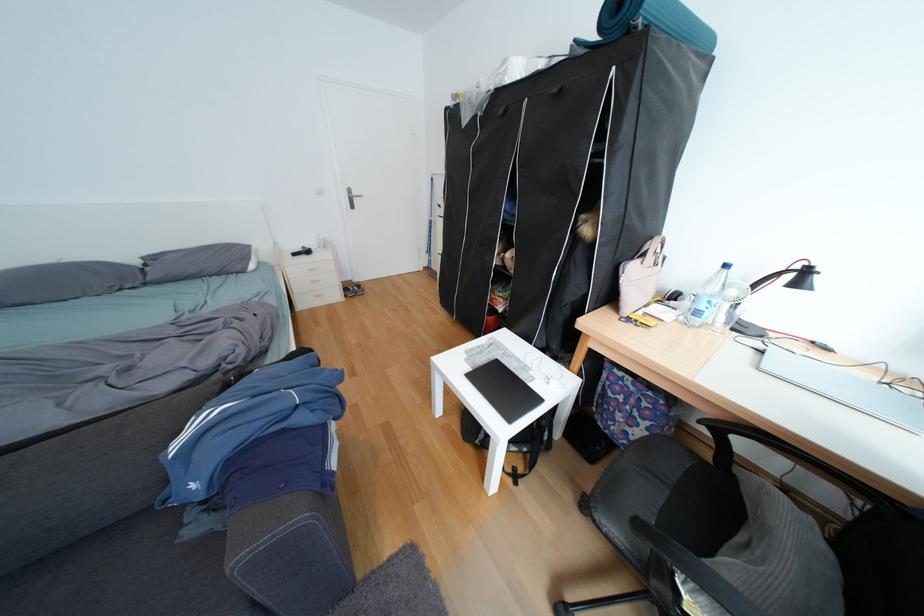
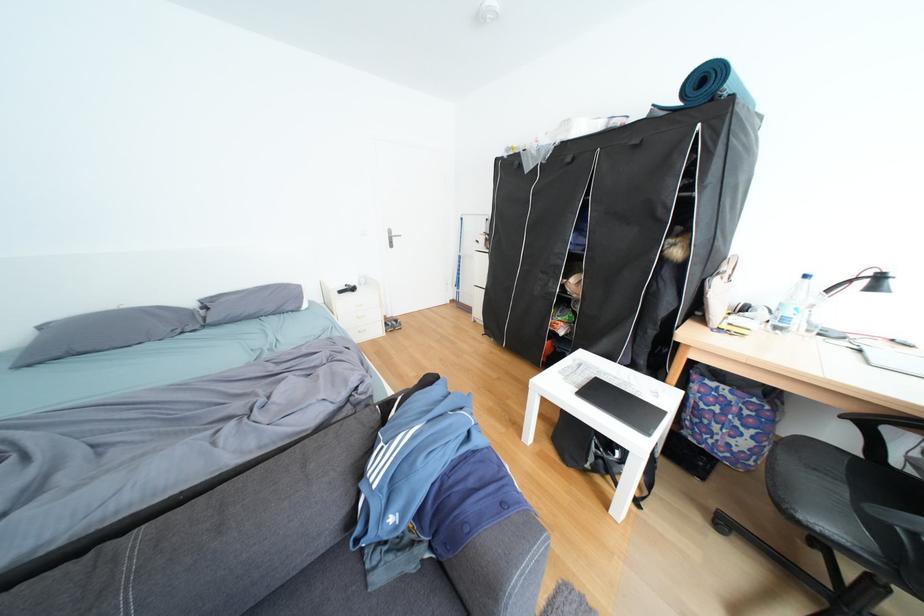
Question: The images are taken continuously from a first-person perspective. In which direction are you moving?

Choices:
 (A) Left
 (B) Right
 (C) Forward
 (D) Backward

Answer: (A)